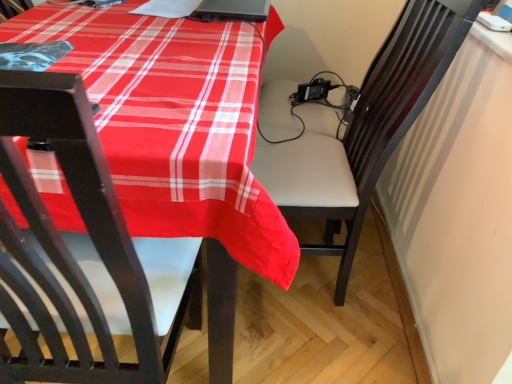
Find the location of `black matte laptop at upper center`. black matte laptop at upper center is located at coordinates (232, 10).

What do you see at coordinates (232, 10) in the screenshot? The height and width of the screenshot is (384, 512). I see `black matte laptop at upper center` at bounding box center [232, 10].

At what (x,y) coordinates should I click in order to perform the action: click on white leather chair at center. Please return your answer as a coordinate pair (x, y). Looking at the image, I should click on (366, 128).

Describe the element at coordinates (366, 128) in the screenshot. Image resolution: width=512 pixels, height=384 pixels. I see `white leather chair at center` at that location.

Where is `black matte laptop at upper center`? This screenshot has width=512, height=384. black matte laptop at upper center is located at coordinates (232, 10).

Can you confirm if black matte laptop at upper center is positioned to the right of white leather chair at center?

No, black matte laptop at upper center is not to the right of white leather chair at center.

Does black matte laptop at upper center lie behind white leather chair at center?

Yes, black matte laptop at upper center is further from the camera.

Is point (225, 20) closer or farther from the camera than point (430, 10)?

Point (225, 20) is positioned farther from the camera compared to point (430, 10).

Looking at this image, from the image's perspective, which object appears higher, black matte laptop at upper center or white leather chair at center?

black matte laptop at upper center.

From a real-world perspective, is black matte laptop at upper center located higher than white leather chair at center?

Correct, in the physical world, black matte laptop at upper center is higher than white leather chair at center.

Considering the sizes of objects black matte laptop at upper center and white leather chair at center in the image provided, who is wider, black matte laptop at upper center or white leather chair at center?

With larger width is white leather chair at center.

Is black matte laptop at upper center taller or shorter than white leather chair at center?

In the image, black matte laptop at upper center appears to be shorter than white leather chair at center.

Between black matte laptop at upper center and white leather chair at center, which one has larger size?

white leather chair at center.

Would you say white leather chair at center is part of black matte laptop at upper center's contents?

No, white leather chair at center is located outside of black matte laptop at upper center.

Are black matte laptop at upper center and white leather chair at center far apart?

That's not correct — black matte laptop at upper center is a little close to white leather chair at center.

Is black matte laptop at upper center positioned with its back to white leather chair at center?

That's not correct — black matte laptop at upper center is not looking away from white leather chair at center.

Identify the location of laptop on the left of white leather chair at center. (232, 10).

Considering the positions of objects white leather chair at center and black matte laptop at upper center in the image provided, who is more to the left, white leather chair at center or black matte laptop at upper center?

Positioned to the left is black matte laptop at upper center.

Which object is closer to the camera taking this photo, white leather chair at center or black matte laptop at upper center?

white leather chair at center is more forward.

Is point (255, 160) positioned after point (240, 1)?

No.

From the image's perspective, relative to black matte laptop at upper center, is white leather chair at center above or below?

From the image's perspective, white leather chair at center appears below black matte laptop at upper center.

From a real-world perspective, is white leather chair at center below black matte laptop at upper center?

Correct, in the physical world, white leather chair at center is lower than black matte laptop at upper center.

Considering the sizes of objects white leather chair at center and black matte laptop at upper center in the image provided, who is wider, white leather chair at center or black matte laptop at upper center?

Wider between the two is white leather chair at center.

Does white leather chair at center have a lesser height compared to black matte laptop at upper center?

No.

Considering the sizes of objects white leather chair at center and black matte laptop at upper center in the image provided, who is smaller, white leather chair at center or black matte laptop at upper center?

Smaller between the two is black matte laptop at upper center.

Do you think white leather chair at center is within black matte laptop at upper center, or outside of it?

white leather chair at center cannot be found inside black matte laptop at upper center.

Is white leather chair at center not near black matte laptop at upper center?

No, there isn't a large distance between white leather chair at center and black matte laptop at upper center.

Looking at this image, is white leather chair at center facing away from black matte laptop at upper center?

No, white leather chair at center is not facing away from black matte laptop at upper center.

How different are the orientations of white leather chair at center and black matte laptop at upper center in degrees?

There is a 86.7-degree angle between the facing directions of white leather chair at center and black matte laptop at upper center.

How far apart are white leather chair at center and black matte laptop at upper center?

white leather chair at center and black matte laptop at upper center are 21.29 inches apart.

The width and height of the screenshot is (512, 384). I want to click on laptop above the white leather chair at center (from a real-world perspective), so click(232, 10).

Identify the location of chair below the black matte laptop at upper center (from the image's perspective). (366, 128).

Locate an element on the screen. laptop that is above the white leather chair at center (from a real-world perspective) is located at coordinates (232, 10).